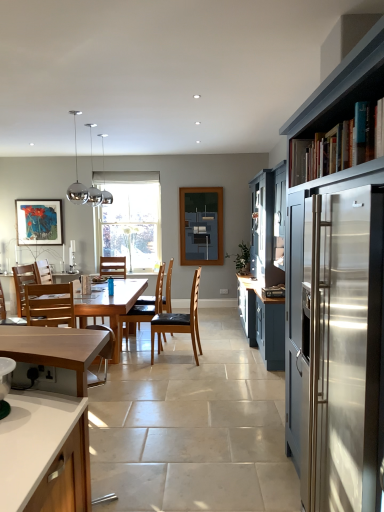
Question: Considering the relative sizes of blue painted wood bookshelf at upper right and brown leather chair at center in the image provided, is blue painted wood bookshelf at upper right shorter than brown leather chair at center?

Choices:
 (A) yes
 (B) no

Answer: (A)

Question: Is blue painted wood bookshelf at upper right to the right of brown leather chair at center from the viewer's perspective?

Choices:
 (A) no
 (B) yes

Answer: (B)

Question: Is blue painted wood bookshelf at upper right far from brown leather chair at center?

Choices:
 (A) yes
 (B) no

Answer: (A)

Question: Can brown leather chair at center be found inside blue painted wood bookshelf at upper right?

Choices:
 (A) yes
 (B) no

Answer: (B)

Question: From the image's perspective, does blue painted wood bookshelf at upper right appear higher than brown leather chair at center?

Choices:
 (A) yes
 (B) no

Answer: (A)

Question: Would you say brown leather chair at center, arranged as the second chair when viewed from the back, is to the left or to the right of matte dark blue cabinet at right, arranged as the first cabinetry when viewed from the right, in the picture?

Choices:
 (A) left
 (B) right

Answer: (A)

Question: From the image's perspective, relative to matte dark blue cabinet at right, arranged as the first cabinetry when viewed from the right, is brown leather chair at center, arranged as the second chair when viewed from the back, above or below?

Choices:
 (A) below
 (B) above

Answer: (A)

Question: From a real-world perspective, is brown leather chair at center, arranged as the second chair when viewed from the back, positioned above or below matte dark blue cabinet at right, the 2th cabinetry viewed from the left?

Choices:
 (A) above
 (B) below

Answer: (B)

Question: In terms of size, does brown leather chair at center, which is the 4th chair from front to back, appear bigger or smaller than matte dark blue cabinet at right, arranged as the first cabinetry when viewed from the right?

Choices:
 (A) big
 (B) small

Answer: (B)

Question: Looking at their shapes, would you say matte glass picture frame at upper left is wider or thinner than matte dark blue cabinet at right, the 2th cabinetry viewed from the left?

Choices:
 (A) wide
 (B) thin

Answer: (B)

Question: From the image's perspective, relative to matte dark blue cabinet at right, the 2th cabinetry viewed from the left, is matte glass picture frame at upper left above or below?

Choices:
 (A) below
 (B) above

Answer: (B)

Question: Considering the relative positions of matte glass picture frame at upper left and matte dark blue cabinet at right, the 2th cabinetry viewed from the left, in the image provided, is matte glass picture frame at upper left to the left or to the right of matte dark blue cabinet at right, the 2th cabinetry viewed from the left,?

Choices:
 (A) left
 (B) right

Answer: (A)

Question: Do you think matte glass picture frame at upper left is within matte dark blue cabinet at right, the 2th cabinetry viewed from the left, or outside of it?

Choices:
 (A) inside
 (B) outside

Answer: (B)

Question: From a real-world perspective, is wooden chair at center, the fifth chair viewed from the front, above or below matte dark blue cabinet at right, the 2th cabinetry viewed from the left?

Choices:
 (A) above
 (B) below

Answer: (B)

Question: Considering their positions, is wooden chair at center, the fifth chair viewed from the front, located in front of or behind matte dark blue cabinet at right, the 2th cabinetry viewed from the left?

Choices:
 (A) front
 (B) behind

Answer: (B)